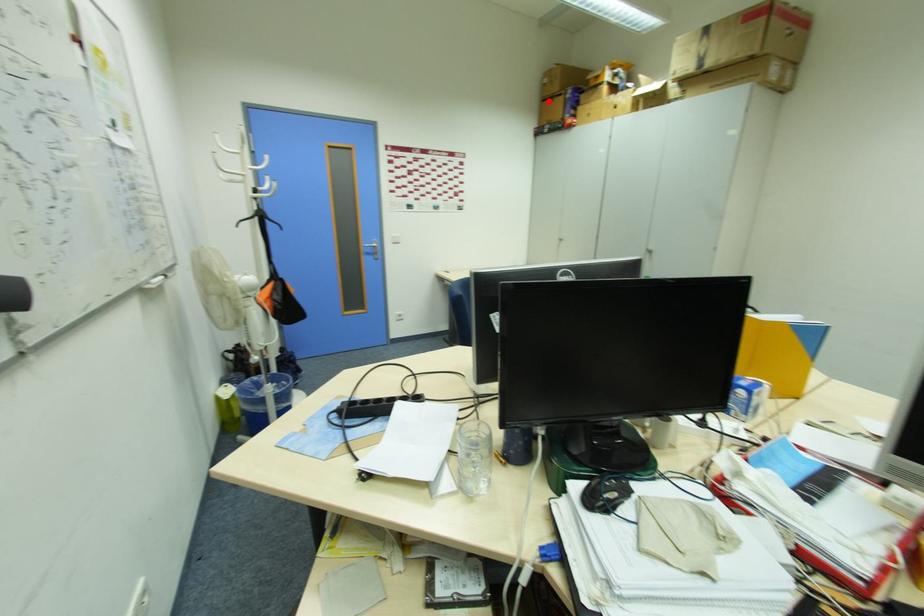
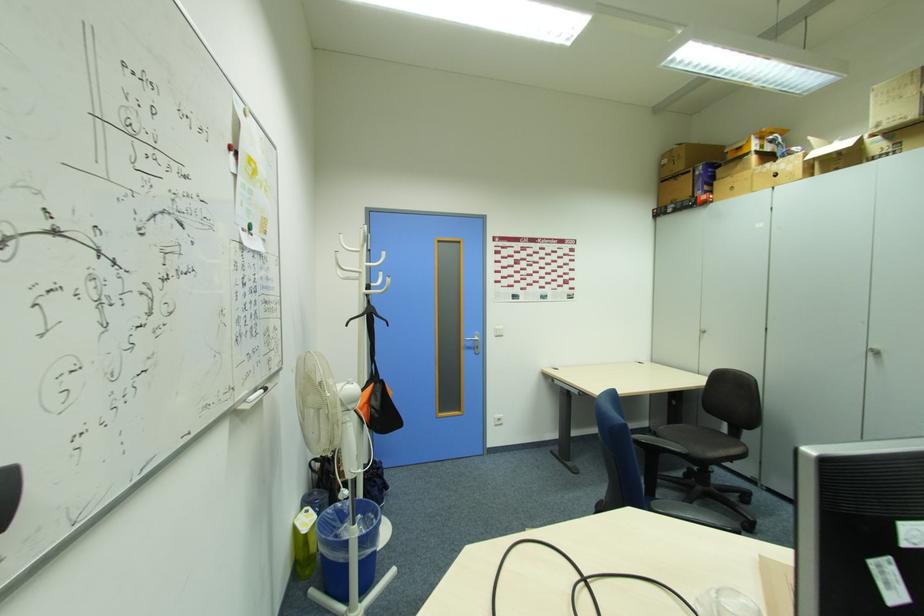
Question: I am providing you with two images of the same scene from different viewpoints. Given a red point in image1, look at the same physical point in image2. Is it:

Choices:
 (A) Closer to the viewpoint
 (B) Farther from the viewpoint

Answer: (B)